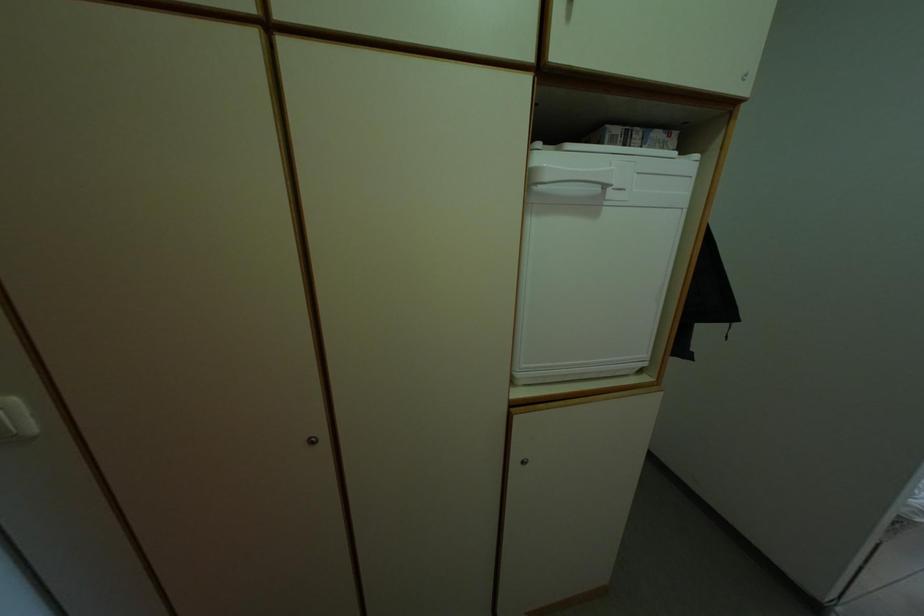
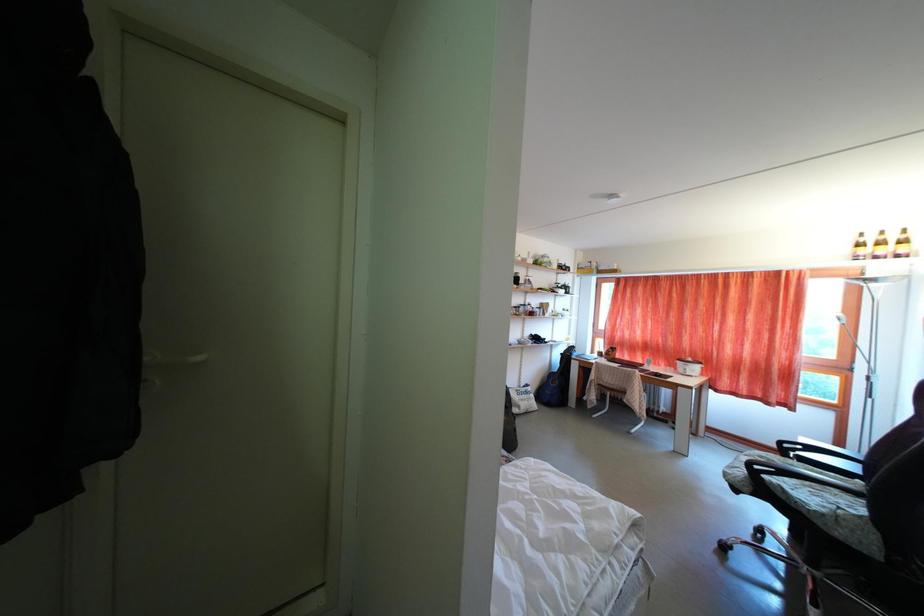
Question: In a continuous first-person perspective shot, in which direction is the camera moving?

Choices:
 (A) Left
 (B) Right
 (C) Forward
 (D) Backward

Answer: (B)